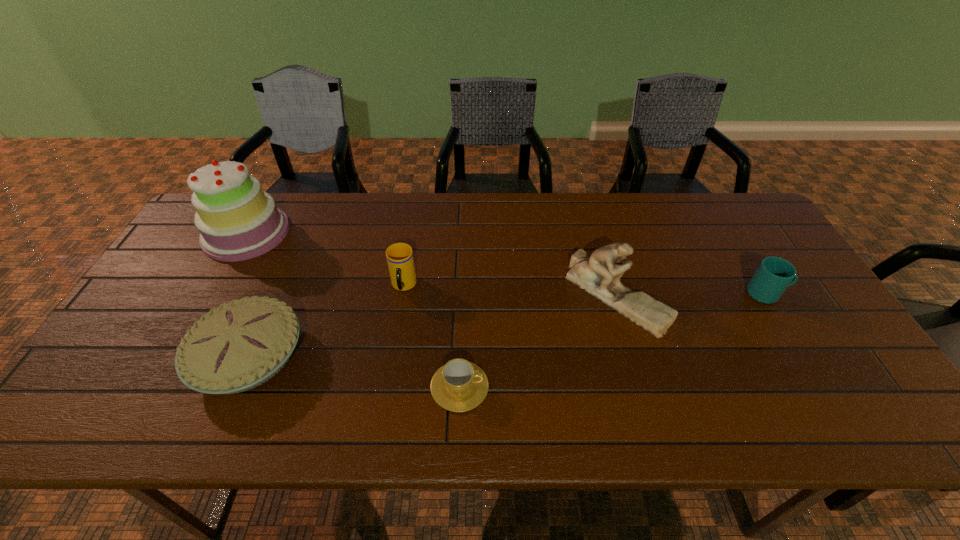
This screenshot has width=960, height=540. What are the coordinates of `cake` in the screenshot? It's located at (237, 220).

At what (x,y) coordinates should I click in order to perform the action: click on the second object from right to left. Please return your answer as a coordinate pair (x, y). The image size is (960, 540). Looking at the image, I should click on (599, 275).

Find the location of a particular element. The image size is (960, 540). the second tallest object is located at coordinates (599, 275).

The image size is (960, 540). In order to click on the fourth object from right to left in this screenshot , I will do `click(399, 256)`.

Locate an element on the screen. Image resolution: width=960 pixels, height=540 pixels. the rightmost object is located at coordinates tap(773, 275).

The image size is (960, 540). In order to click on the second tallest cup in this screenshot , I will do `click(773, 275)`.

The image size is (960, 540). Find the location of `pie`. pie is located at coordinates (238, 346).

Image resolution: width=960 pixels, height=540 pixels. I want to click on the nearest cup, so click(x=459, y=385).

You are a GUI agent. You are given a task and a screenshot of the screen. Output one action in this format:
    pyautogui.click(x=<x>, y=<y>)
    Task: Click on the second cup from left to right
    
    Given the screenshot: What is the action you would take?
    pyautogui.click(x=459, y=385)

The image size is (960, 540). I want to click on free region located 0.210m on the right of the tallest object, so click(x=354, y=233).